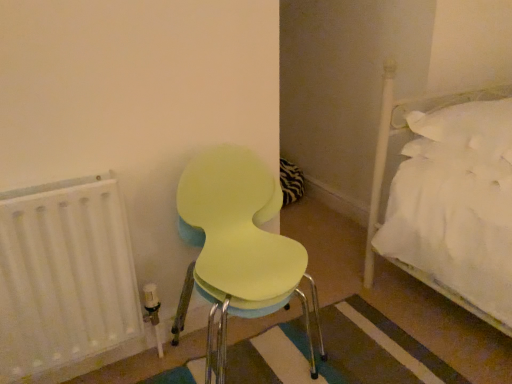
Identify the location of vacant space to the right of light yellow plastic chair at center-left. Image resolution: width=512 pixels, height=384 pixels. (360, 335).